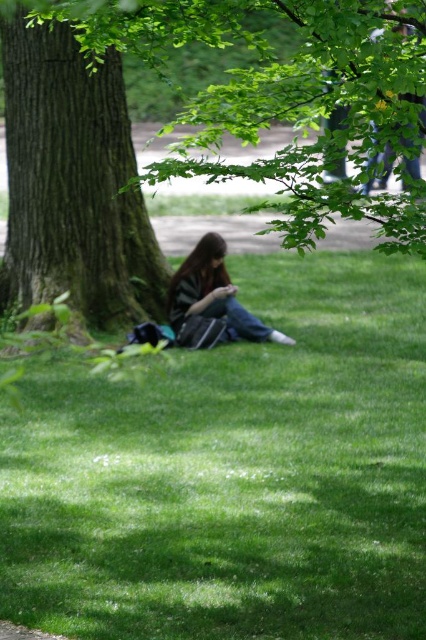
Question: Among these points, which one is farthest from the camera?

Choices:
 (A) (187, 316)
 (B) (40, 195)
 (C) (92, 509)
 (D) (316, 20)

Answer: (B)

Question: Does green grass at lower left come behind striped fabric shirt at center?

Choices:
 (A) no
 (B) yes

Answer: (A)

Question: Is green leafy tree at center below dark brown textured tree trunk at left?

Choices:
 (A) yes
 (B) no

Answer: (A)

Question: Which point is closer to the camera?

Choices:
 (A) (253, 83)
 (B) (42, 298)
 (C) (417, 387)
 (D) (198, 269)

Answer: (A)

Question: Which point is closer to the camera?

Choices:
 (A) striped fabric shirt at center
 (B) dark brown textured tree trunk at left
 (C) green grass at lower left

Answer: (C)

Question: Does green grass at lower left have a larger size compared to striped fabric shirt at center?

Choices:
 (A) yes
 (B) no

Answer: (A)